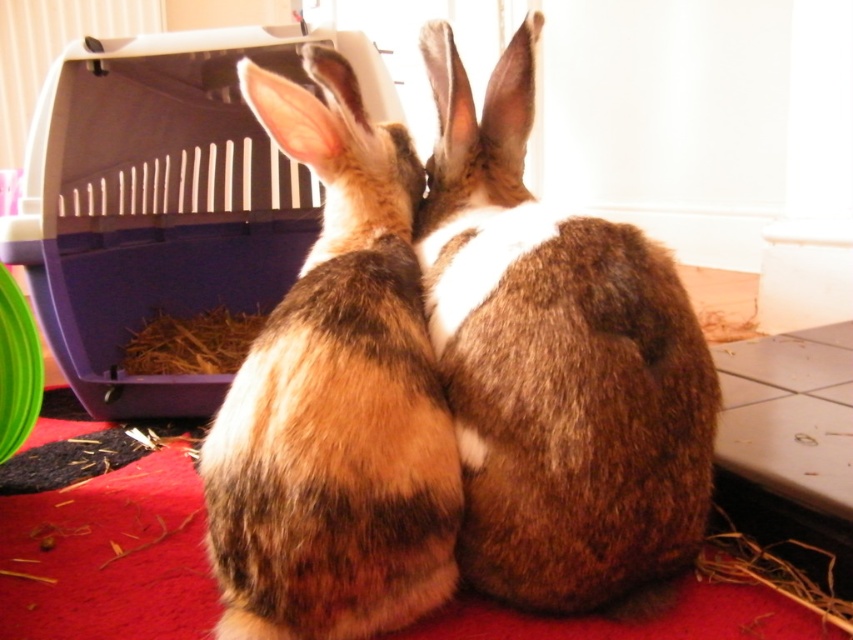
Which of these two, brown furry rabbit at center or brown fuzzy rabbit at center, stands taller?

brown furry rabbit at center

Who is lower down, brown furry rabbit at center or brown fuzzy rabbit at center?

brown fuzzy rabbit at center

Is point (608, 330) closer to camera compared to point (283, 506)?

No.

Locate an element on the screen. The width and height of the screenshot is (853, 640). brown furry rabbit at center is located at coordinates (555, 362).